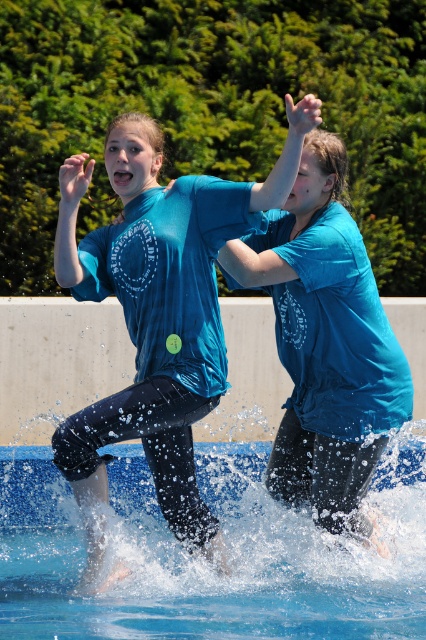
Locate an element on the screen. matte blue t-shirt at center is located at coordinates (160, 305).

Measure the distance from blue rubber swimming pool at lower center to matte blue shirt at center.

A distance of 1.31 meters exists between blue rubber swimming pool at lower center and matte blue shirt at center.

Between blue rubber swimming pool at lower center and matte blue shirt at center, which one is positioned lower?

Positioned lower is blue rubber swimming pool at lower center.

Who is more distant from viewer, (181, 636) or (307, 477)?

The point (307, 477) is more distant.

Locate an element on the screen. The image size is (426, 640). blue rubber swimming pool at lower center is located at coordinates (204, 561).

How distant is blue rubber swimming pool at lower center from matte blue t-shirt at center?

The distance of blue rubber swimming pool at lower center from matte blue t-shirt at center is 4.57 feet.

Looking at this image, who is positioned more to the right, blue rubber swimming pool at lower center or matte blue t-shirt at center?

From the viewer's perspective, blue rubber swimming pool at lower center appears more on the right side.

Which is in front, point (166, 531) or point (112, 262)?

Positioned in front is point (112, 262).

Find the location of a particular element. blue rubber swimming pool at lower center is located at coordinates (204, 561).